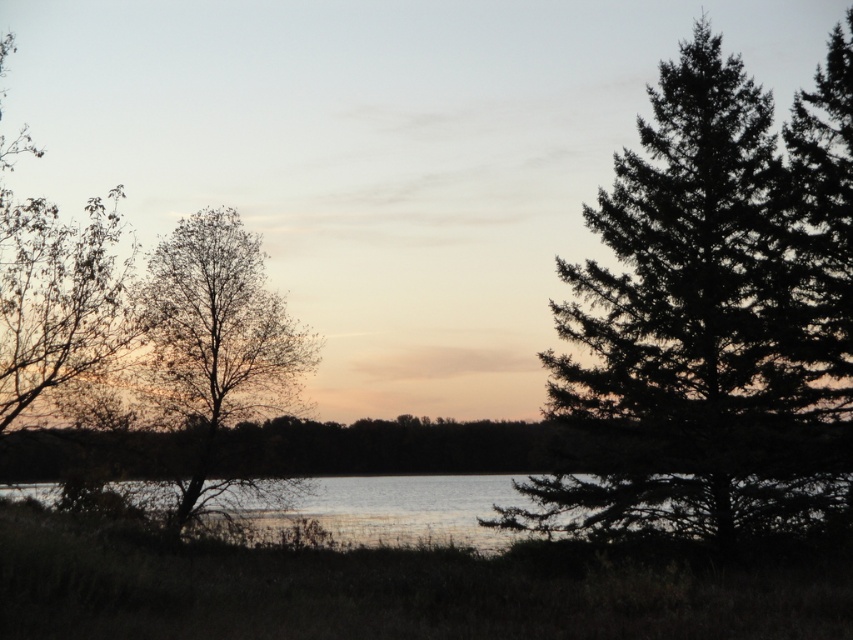
You are standing on the right side of the clear water at center and want to reach the brown leafy tree at left. Which direction should you walk to get there?

The brown leafy tree at left is positioned on the left side of clear water at center, so you should walk to the left to reach it.

You are standing at the center of the scene and want to walk directly towards the dark green textured pine tree at right. In which general direction should you head?

Since the dark green textured pine tree at right is located at coordinates approximately 0.497 along the x and 0.835 along the y axis, you should head towards the right side of the scene to reach it.